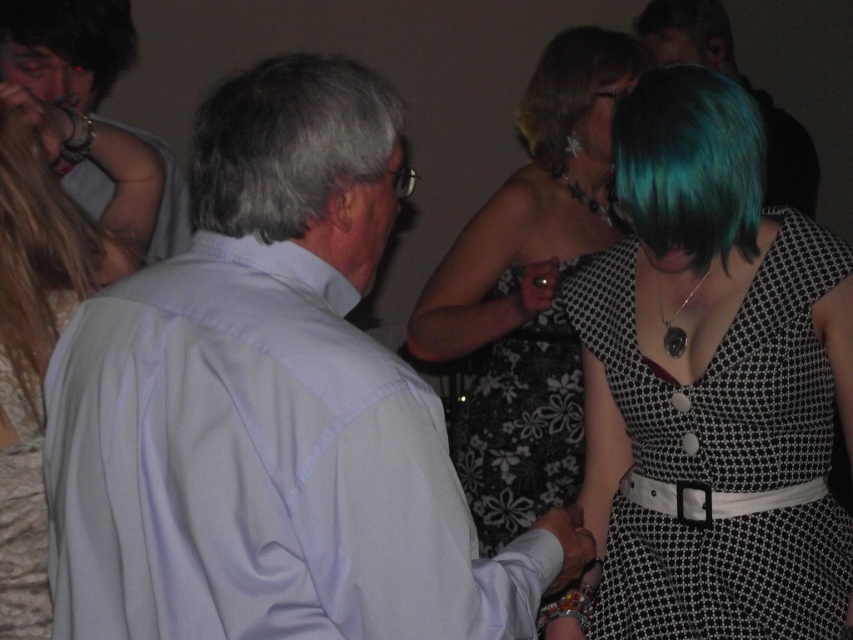
You are a photographer at the event and want to capture a photo of both the teal hair at center and the teal glossy hair at upper center in the same frame. Given that your camera has a maximum focus range of 38 inches, will both subjects be in focus?

The teal hair at center is 38.75 inches from the teal glossy hair at upper center. Since the distance exceeds the camera maximum focus range of 38 inches, the two subjects will not be in focus simultaneously.

You are a photographer at the event and want to capture a closeup of the teal glossy hair at upper center and the matte white hand at lower center in the same frame. Which object should you focus on first if you want to ensure both are in focus?

The teal glossy hair at upper center is wider than the matte white hand at lower center, so you should focus on the teal glossy hair at upper center first to ensure both are in focus.